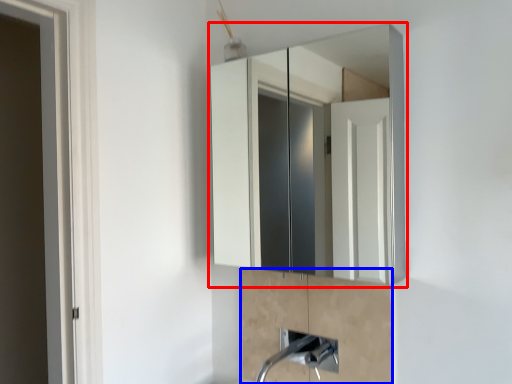
Question: Among these objects, which one is nearest to the camera, medicine cabinet (highlighted by a red box) or cabinetry (highlighted by a blue box)?

Choices:
 (A) medicine cabinet
 (B) cabinetry

Answer: (A)